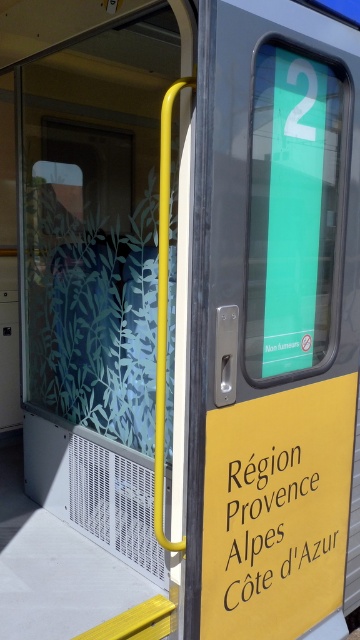
Does point (259, 465) lie in front of point (258, 508)?

Yes, point (259, 465) is closer to viewer.

Is yellow matte signboard at center below yellow matte sign at center?

Actually, yellow matte signboard at center is above yellow matte sign at center.

You are a GUI agent. You are given a task and a screenshot of the screen. Output one action in this format:
    pyautogui.click(x=<x>, y=<y>)
    Task: Click on the yellow matte signboard at center
    This screenshot has height=640, width=360.
    Given the screenshot: What is the action you would take?
    pyautogui.click(x=280, y=321)